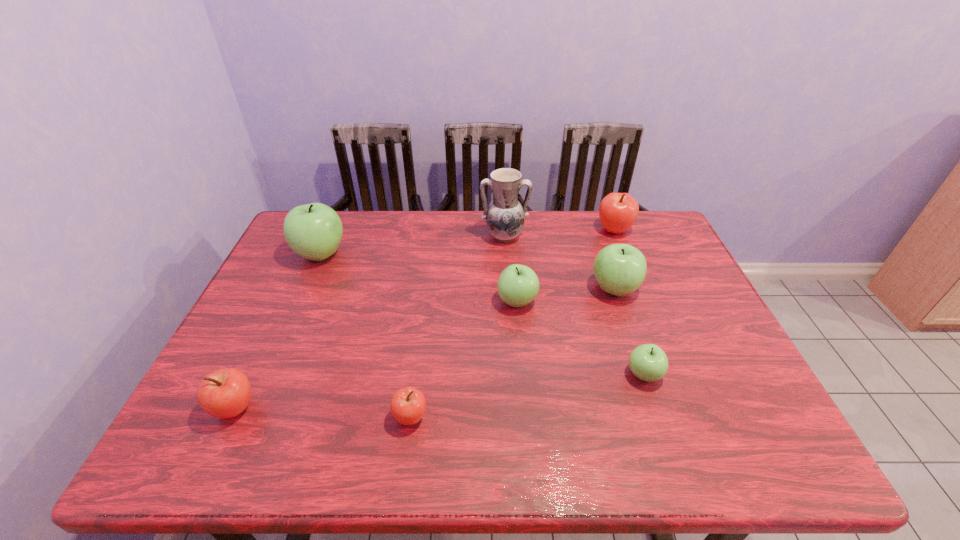
You are a GUI agent. You are given a task and a screenshot of the screen. Output one action in this format:
    pyautogui.click(x=<x>, y=<y>)
    Task: Click on the tallest object
    
    Given the screenshot: What is the action you would take?
    pyautogui.click(x=505, y=216)

Where is `the tallest apple`? This screenshot has height=540, width=960. the tallest apple is located at coordinates (313, 231).

At what (x,y) coordinates should I click in order to perform the action: click on the leftmost green apple. Please return your answer as a coordinate pair (x, y). This screenshot has height=540, width=960. Looking at the image, I should click on (313, 231).

Locate an element on the screen. The width and height of the screenshot is (960, 540). the biggest pink apple is located at coordinates (618, 211).

The width and height of the screenshot is (960, 540). I want to click on the rightmost pink apple, so click(x=618, y=211).

The height and width of the screenshot is (540, 960). In order to click on the second biggest green apple in this screenshot , I will do `click(620, 269)`.

This screenshot has width=960, height=540. What are the coordinates of `the fourth apple from right to left` in the screenshot? It's located at (518, 285).

You are a GUI agent. You are given a task and a screenshot of the screen. Output one action in this format:
    pyautogui.click(x=<x>, y=<y>)
    Task: Click on the third green apple from right to left
    
    Given the screenshot: What is the action you would take?
    pyautogui.click(x=518, y=285)

Find the location of a particular element. This screenshot has height=540, width=960. the leftmost pink apple is located at coordinates (225, 393).

Where is `the nearest green apple`? The image size is (960, 540). the nearest green apple is located at coordinates 648,362.